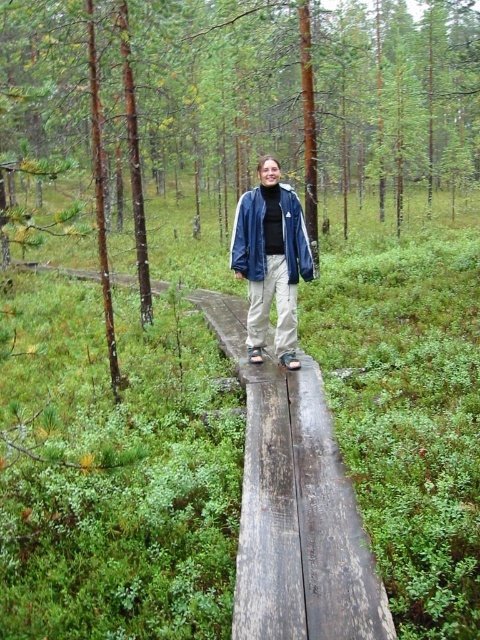
Between brown wood tree at center and matte blue jacket at center, which one is positioned lower?

matte blue jacket at center is below.

Which is behind, point (82, 28) or point (303, 220)?

Point (82, 28)

Locate an element on the screen. Image resolution: width=480 pixels, height=640 pixels. brown wood tree at center is located at coordinates (291, 97).

Is brown wood tree at center bigger than blue denim jacket at center?

Correct, brown wood tree at center is larger in size than blue denim jacket at center.

Is point (202, 144) positioned in front of point (252, 212)?

No.

Who is more distant from viewer, (288,49) or (242,211)?

The point (288,49) is behind.

Find the location of `brown wood tree at center`. brown wood tree at center is located at coordinates (291, 97).

Between point (264, 205) and point (247, 202), which one is positioned in front?

Positioned in front is point (264, 205).

Is matte blue jacket at center bigger than blue denim jacket at center?

Correct, matte blue jacket at center is larger in size than blue denim jacket at center.

Is point (241, 204) positioned behind point (262, 269)?

Yes, point (241, 204) is behind point (262, 269).

Identify the location of matte blue jacket at center. The width and height of the screenshot is (480, 640). (271, 259).